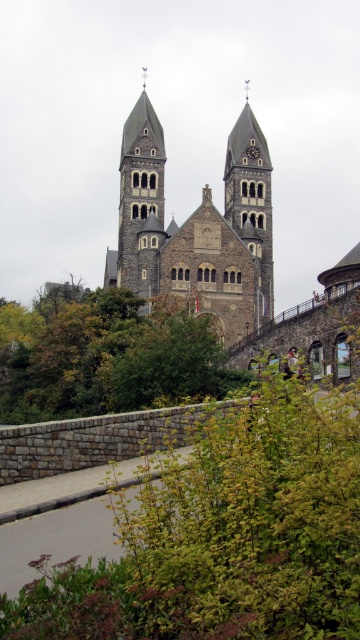
Question: Is brown stone church at center thinner than green leafy tree at center?

Choices:
 (A) yes
 (B) no

Answer: (A)

Question: Which of the following is the closest to the observer?

Choices:
 (A) (160, 262)
 (B) (133, 211)

Answer: (A)

Question: Estimate the real-world distances between objects in this image. Which object is farther from the stone tower at center?

Choices:
 (A) green leafy tree at center
 (B) brown stone church at center
 (C) smooth stone tower at center

Answer: (A)

Question: Is brown stone church at center below smooth stone tower at center?

Choices:
 (A) no
 (B) yes

Answer: (B)

Question: Is green leafy tree at center further to camera compared to stone tower at center?

Choices:
 (A) no
 (B) yes

Answer: (A)

Question: Which point is closer to the camera?

Choices:
 (A) green leafy tree at center
 (B) stone tower at center

Answer: (A)